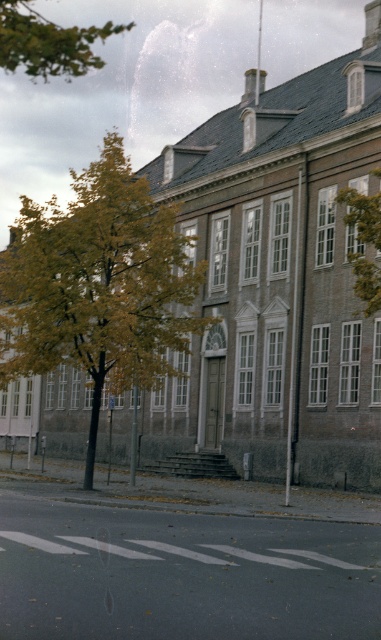
In the scene shown: Does yellow-green leaves at center have a greater height compared to green leafy tree at upper left?

In fact, yellow-green leaves at center may be shorter than green leafy tree at upper left.

Which is behind, point (97, 348) or point (43, 58)?

Positioned behind is point (97, 348).

From the picture: Who is more distant from viewer, (142,259) or (83,70)?

Positioned behind is point (142,259).

Image resolution: width=381 pixels, height=640 pixels. I want to click on yellow-green leaves at center, so click(x=99, y=285).

Can you confirm if yellow-green leaves at center is positioned to the right of white plastic sign at center?

Incorrect, yellow-green leaves at center is not on the right side of white plastic sign at center.

Between yellow-green leaves at center and white plastic sign at center, which one has more height?

With more height is yellow-green leaves at center.

Where is `yellow-green leaves at center`? yellow-green leaves at center is located at coordinates (99, 285).

Where is `yellow-green leaves at center`? Image resolution: width=381 pixels, height=640 pixels. yellow-green leaves at center is located at coordinates (99, 285).

Measure the distance between green leafy tree at upper left and camera.

green leafy tree at upper left and camera are 11.09 meters apart.

Does green leafy tree at upper left come in front of green leafy tree at upper right?

Yes, it is in front of green leafy tree at upper right.

What do you see at coordinates (48, 42) in the screenshot? The height and width of the screenshot is (640, 381). I see `green leafy tree at upper left` at bounding box center [48, 42].

You are a GUI agent. You are given a task and a screenshot of the screen. Output one action in this format:
    pyautogui.click(x=<x>, y=<y>)
    Task: Click on the green leafy tree at upper left
    
    Given the screenshot: What is the action you would take?
    pyautogui.click(x=48, y=42)